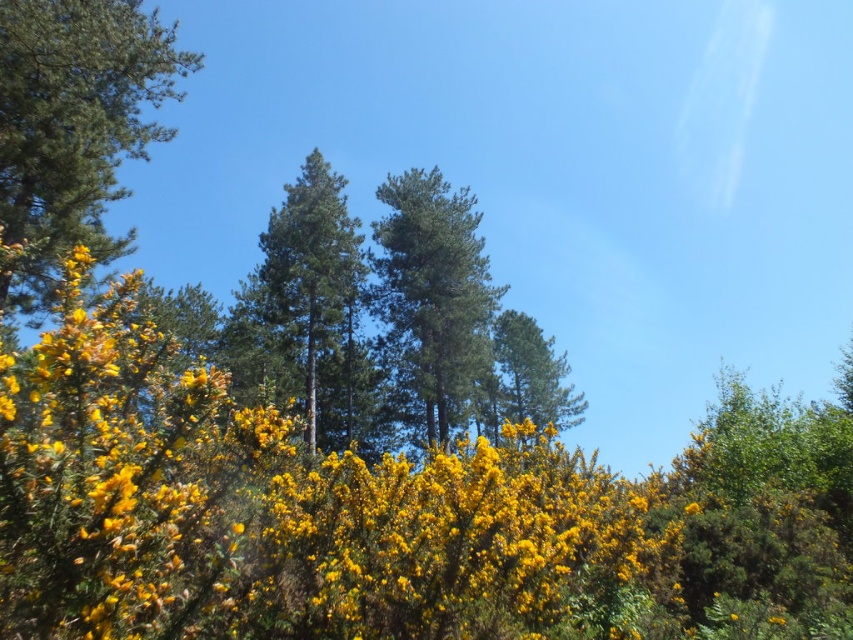
Question: Which of the following is the closest to the observer?

Choices:
 (A) green matte tree at center
 (B) green textured pine tree at center

Answer: (B)

Question: In this image, where is green textured pine tree at center located relative to green textured tree at center?

Choices:
 (A) below
 (B) above

Answer: (B)

Question: Can you confirm if green matte tree at center is thinner than green textured tree at center?

Choices:
 (A) no
 (B) yes

Answer: (A)

Question: Which object is positioned farthest from the green textured tree at center?

Choices:
 (A) green needle-like at upper left
 (B) green textured pine tree at center

Answer: (A)

Question: Which point is closer to the camera?

Choices:
 (A) green textured tree at center
 (B) green textured pine tree at center
 (C) green matte tree at center
 (D) yellow fluffy bush at center

Answer: (D)

Question: Is yellow fluffy bush at center wider than green matte tree at center?

Choices:
 (A) no
 (B) yes

Answer: (B)